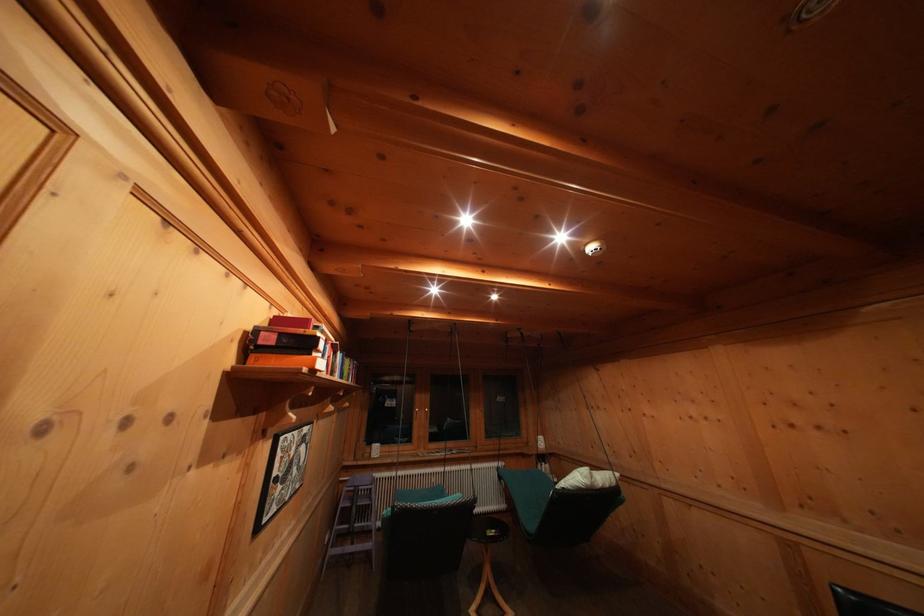
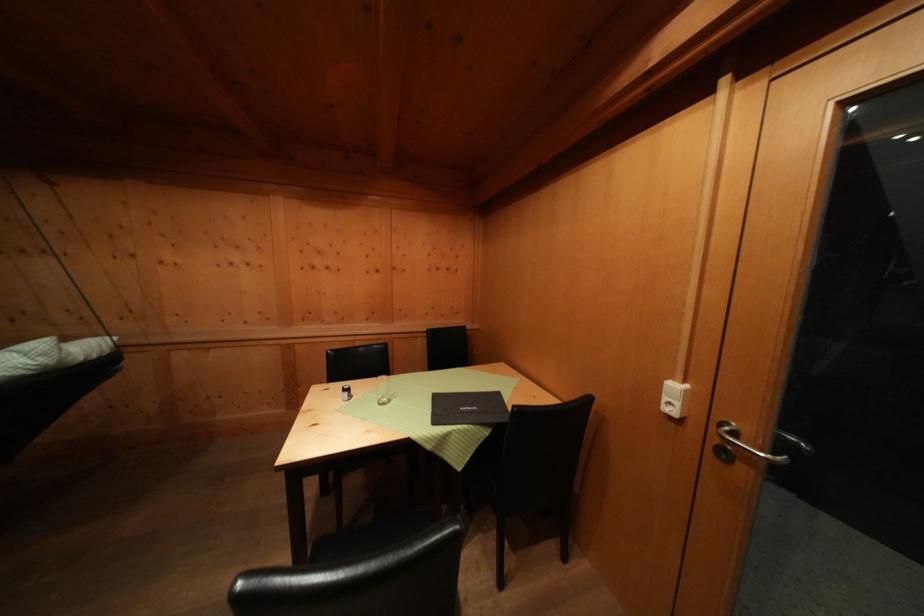
Question: The camera is either moving clockwise (left) or counter-clockwise (right) around the object. The first image is from the beginning of the video and the second image is from the end. Is the camera moving left or right when shooting the video?

Choices:
 (A) Left
 (B) Right

Answer: (A)